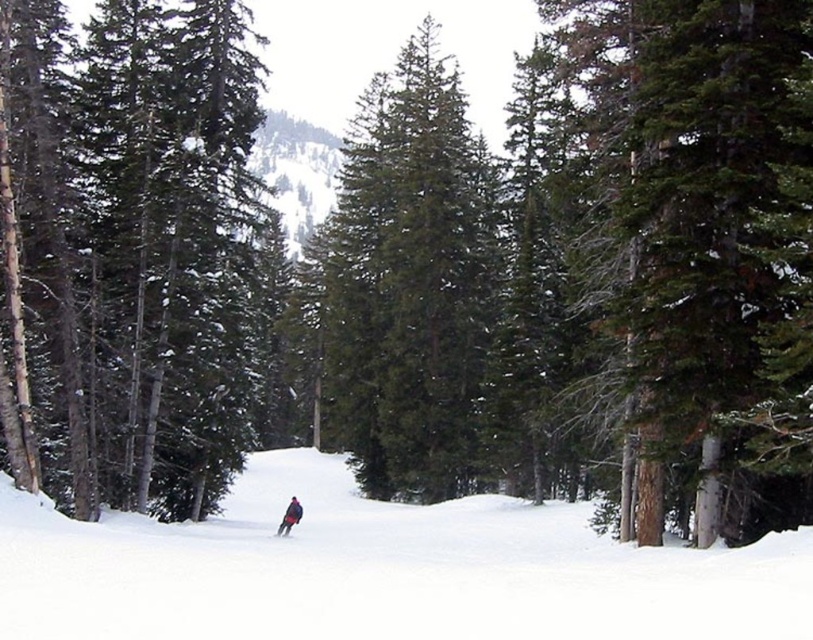
Can you confirm if white snow ski slope at center is thinner than dark blue snowboarder at center?

Incorrect, white snow ski slope at center's width is not less than dark blue snowboarder at center's.

Which is below, white snow ski slope at center or dark blue snowboarder at center?

dark blue snowboarder at center is below.

Is point (715, 580) closer to viewer compared to point (290, 525)?

Yes.

Find the location of a particular element. This screenshot has width=813, height=640. white snow ski slope at center is located at coordinates (381, 570).

Is dark blue snowboarder at center wider than shiny black ski at center?

Indeed, dark blue snowboarder at center has a greater width compared to shiny black ski at center.

This screenshot has width=813, height=640. What do you see at coordinates (289, 516) in the screenshot? I see `dark blue snowboarder at center` at bounding box center [289, 516].

This screenshot has height=640, width=813. In order to click on dark blue snowboarder at center in this screenshot , I will do (x=289, y=516).

Does green matte tree at center have a lesser height compared to dark blue snowboarder at center?

In fact, green matte tree at center may be taller than dark blue snowboarder at center.

Does green matte tree at center have a greater width compared to dark blue snowboarder at center?

Yes.

This screenshot has width=813, height=640. Describe the element at coordinates (137, 246) in the screenshot. I see `green matte tree at center` at that location.

Where is `green matte tree at center`? green matte tree at center is located at coordinates (137, 246).